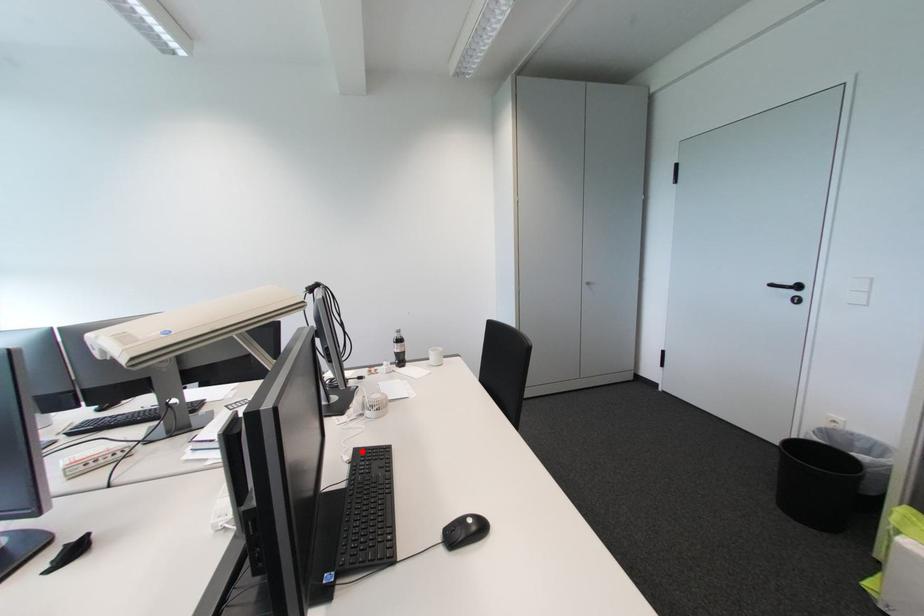
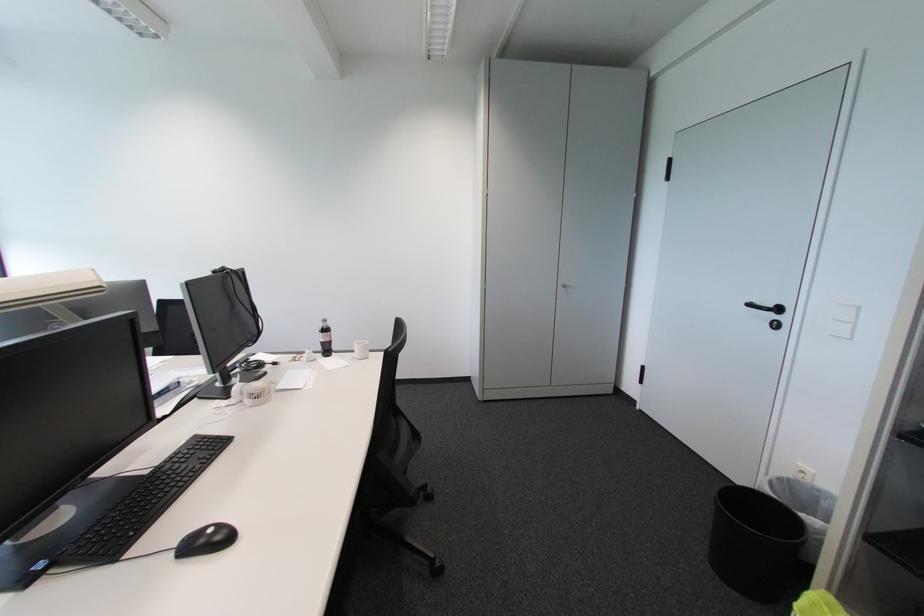
Where in the second image is the point corresponding to the highlighted location from the first image?

(202, 438)